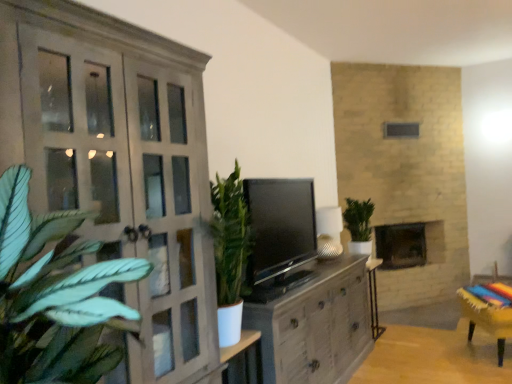
Question: Based on their positions, is matte gray cupboard at left located to the left or right of matte gray cabinet at center?

Choices:
 (A) right
 (B) left

Answer: (B)

Question: Is matte gray cupboard at left bigger or smaller than matte gray cabinet at center?

Choices:
 (A) small
 (B) big

Answer: (A)

Question: Estimate the real-world distances between objects in this image. Which object is closer to the matte gray cabinet at center?

Choices:
 (A) dark gray stone fireplace at center
 (B) wooden table at lower right, the first table positioned from the bottom
 (C) wooden stool at lower right
 (D) metallic silver table at lower right, placed as the first table when sorted from top to bottom
 (E) green leafy plant at center

Answer: (B)

Question: Estimate the real-world distances between objects in this image. Which object is farther from the wooden table at lower right, placed as the 1th table when sorted from front to back?

Choices:
 (A) black glossy tv at center
 (B) dark gray stone fireplace at center
 (C) green leafy plant at center
 (D) matte gray cabinet at center
 (E) matte gray cupboard at left

Answer: (E)